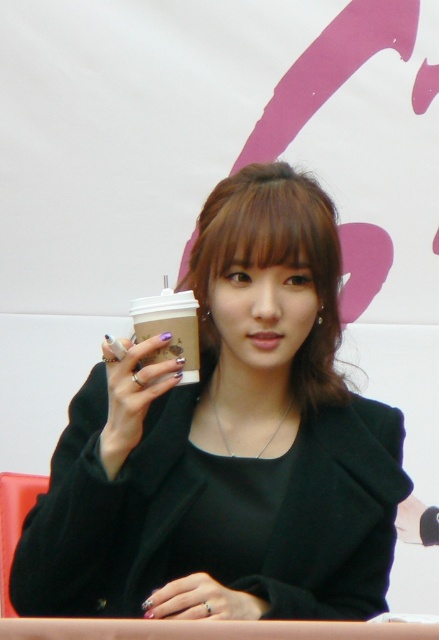
Question: Can you confirm if matte black jacket at center is thinner than nail polish at center?

Choices:
 (A) yes
 (B) no

Answer: (B)

Question: Which object is positioned farthest from the brown matte bangs at center?

Choices:
 (A) matte plastic cup at center
 (B) smooth wooden table at lower center

Answer: (B)

Question: Which object is positioned farthest from the black matte hand at lower right?

Choices:
 (A) matte plastic cup at center-left
 (B) smooth wooden table at lower center
 (C) matte plastic cup at center

Answer: (A)

Question: Does matte plastic cup at center-left appear on the left side of brown matte bangs at center?

Choices:
 (A) no
 (B) yes

Answer: (B)

Question: Which of the following is the farthest from the observer?

Choices:
 (A) (179, 337)
 (B) (269, 257)
 (C) (403, 540)
 (D) (140, 356)

Answer: (C)

Question: Where is nail polish at center located in relation to brown matte bangs at center in the image?

Choices:
 (A) below
 (B) above

Answer: (A)